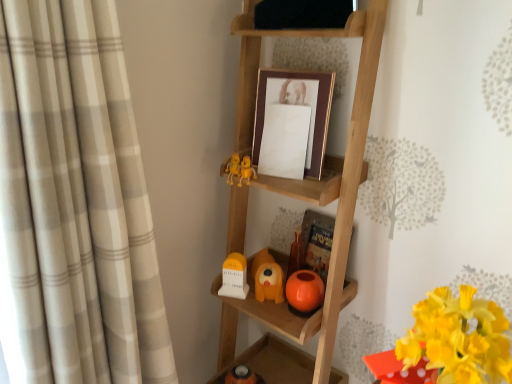
Measure the distance between beige plaid curtain at left and camera.

The depth of beige plaid curtain at left is 21.51 inches.

In order to face black matte shelf at upper center, which is counted as the first shelf, starting from the top, should I rotate leftwards or rightwards?

To face it directly, rotate right by 6.057 degrees.

You are a GUI agent. You are given a task and a screenshot of the screen. Output one action in this format:
    pyautogui.click(x=<x>, y=<y>)
    Task: Click on the white matte clock at lower center, acting as the 2th toy starting from the right
    The image size is (512, 384).
    Given the screenshot: What is the action you would take?
    pyautogui.click(x=234, y=277)

Image resolution: width=512 pixels, height=384 pixels. In order to click on wooden ladder at center, which is the 1th shelf in bottom-to-top order in this screenshot , I will do `click(307, 200)`.

This screenshot has width=512, height=384. What do you see at coordinates (267, 278) in the screenshot?
I see `orange matte dog at center, arranged as the 2th toy when viewed from the left` at bounding box center [267, 278].

In order to face yellow matte flower at lower right, should I rotate leftwards or rightwards?

You should look right and rotate roughly 24.596 degrees.

This screenshot has width=512, height=384. I want to click on beige plaid curtain at left, so tap(75, 203).

From the image's perspective, which object appears higher, white matte clock at lower center, acting as the 2th toy starting from the right, or wooden ladder at center, which is the 1th shelf in bottom-to-top order?

From the image's view, wooden ladder at center, which is the 1th shelf in bottom-to-top order, is above.

Are white matte clock at lower center, acting as the 2th toy starting from the right, and wooden ladder at center, the second shelf viewed from the top, making contact?

No, white matte clock at lower center, acting as the 2th toy starting from the right, is not with wooden ladder at center, the second shelf viewed from the top.

Can we say white matte clock at lower center, which is the first toy in left-to-right order, lies outside wooden ladder at center, the second shelf viewed from the top?

No, white matte clock at lower center, which is the first toy in left-to-right order, is not entirely external to wooden ladder at center, the second shelf viewed from the top.

Is yellow matte flower at lower right positioned beyond the bounds of gold/maroon picture frame at center?

Yes, yellow matte flower at lower right is located beyond the bounds of gold/maroon picture frame at center.

Can you confirm if yellow matte flower at lower right is positioned to the right of gold/maroon picture frame at center?

Yes.

Can you tell me how much yellow matte flower at lower right and gold/maroon picture frame at center differ in facing direction?

The angular difference between yellow matte flower at lower right and gold/maroon picture frame at center is 0.000975 degrees.

Is yellow matte flower at lower right next to gold/maroon picture frame at center and touching it?

yellow matte flower at lower right is not next to gold/maroon picture frame at center, and they're not touching.

Which of these two, gold/maroon picture frame at center or yellow matte flower at lower right, stands taller?

With more height is yellow matte flower at lower right.

Consider the image. From the image's perspective, between gold/maroon picture frame at center and yellow matte flower at lower right, which one is located above?

gold/maroon picture frame at center.

Is gold/maroon picture frame at center not inside yellow matte flower at lower right?

Yes, gold/maroon picture frame at center is outside of yellow matte flower at lower right.

Is gold/maroon picture frame at center facing towards yellow matte flower at lower right?

No, gold/maroon picture frame at center does not turn towards yellow matte flower at lower right.

From the image's perspective, is gold/maroon picture frame at center located above beige plaid curtain at left?

Correct, gold/maroon picture frame at center appears higher than beige plaid curtain at left in the image.

Is gold/maroon picture frame at center wider than beige plaid curtain at left?

In fact, gold/maroon picture frame at center might be narrower than beige plaid curtain at left.

Considering the positions of objects gold/maroon picture frame at center and beige plaid curtain at left in the image provided, who is in front, gold/maroon picture frame at center or beige plaid curtain at left?

beige plaid curtain at left is more forward.

Which is in front, point (270, 75) or point (37, 276)?

Positioned in front is point (37, 276).

From a real-world perspective, is black matte shelf at upper center, the second shelf from the bottom, physically located above or below wooden ladder at center, which is the 1th shelf in bottom-to-top order?

From a real-world perspective, black matte shelf at upper center, the second shelf from the bottom, is physically above wooden ladder at center, which is the 1th shelf in bottom-to-top order.

From the picture: Choose the correct answer: Is black matte shelf at upper center, which is counted as the first shelf, starting from the top, inside wooden ladder at center, which is the 1th shelf in bottom-to-top order, or outside it?

black matte shelf at upper center, which is counted as the first shelf, starting from the top, fits inside wooden ladder at center, which is the 1th shelf in bottom-to-top order.

Does black matte shelf at upper center, the second shelf from the bottom, have a larger size compared to wooden ladder at center, which is the 1th shelf in bottom-to-top order?

Actually, black matte shelf at upper center, the second shelf from the bottom, might be smaller than wooden ladder at center, which is the 1th shelf in bottom-to-top order.

Is black matte shelf at upper center, which is counted as the first shelf, starting from the top, positioned with its back to wooden ladder at center, which is the 1th shelf in bottom-to-top order?

No.

The width and height of the screenshot is (512, 384). In order to click on shelf on the right of the wooden ladder at center, the second shelf viewed from the top in this screenshot , I will do `click(296, 30)`.

Is wooden ladder at center, which is the 1th shelf in bottom-to-top order, beside black matte shelf at upper center, which is counted as the first shelf, starting from the top?

There is a gap between wooden ladder at center, which is the 1th shelf in bottom-to-top order, and black matte shelf at upper center, which is counted as the first shelf, starting from the top.

Who is smaller, wooden ladder at center, which is the 1th shelf in bottom-to-top order, or black matte shelf at upper center, which is counted as the first shelf, starting from the top?

black matte shelf at upper center, which is counted as the first shelf, starting from the top, is smaller.

Is wooden ladder at center, which is the 1th shelf in bottom-to-top order, further to camera compared to black matte shelf at upper center, which is counted as the first shelf, starting from the top?

No, wooden ladder at center, which is the 1th shelf in bottom-to-top order, is closer to the camera.

Is white matte clock at lower center, which is the first toy in left-to-right order, facing away from yellow matte flower at lower right?

No.

Does white matte clock at lower center, acting as the 2th toy starting from the right, have a larger size compared to yellow matte flower at lower right?

No.

Is white matte clock at lower center, acting as the 2th toy starting from the right, to the left of yellow matte flower at lower right from the viewer's perspective?

Correct, you'll find white matte clock at lower center, acting as the 2th toy starting from the right, to the left of yellow matte flower at lower right.

Considering the positions of point (233, 287) and point (472, 354), is point (233, 287) closer or farther from the camera than point (472, 354)?

Point (233, 287) is positioned farther from the camera compared to point (472, 354).

From the image's perspective, which toy is the 2nd one below the wooden ladder at center, the second shelf viewed from the top? Please provide its 2D coordinates.

[(234, 277)]

The image size is (512, 384). What are the coordinates of `picture frame behind the yellow matte flower at lower right` in the screenshot? It's located at (297, 104).

From the image, which object appears to be farther from gold/maroon picture frame at center, beige plaid curtain at left or orange matte dog at center, the first toy when ordered from right to left?

beige plaid curtain at left is positioned further to the anchor gold/maroon picture frame at center.

Looking at the image, which one is located closer to gold/maroon picture frame at center, orange matte dog at center, the first toy when ordered from right to left, or white matte clock at lower center, acting as the 2th toy starting from the right?

orange matte dog at center, the first toy when ordered from right to left, is closer to gold/maroon picture frame at center.

In the scene shown: When comparing their distances from gold/maroon picture frame at center, does beige plaid curtain at left or white matte clock at lower center, acting as the 2th toy starting from the right, seem closer?

Based on the image, white matte clock at lower center, acting as the 2th toy starting from the right, appears to be nearer to gold/maroon picture frame at center.

Consider the image. Estimate the real-world distances between objects in this image. Which object is further from gold/maroon picture frame at center, black matte shelf at upper center, the second shelf from the bottom, or wooden ladder at center, which is the 1th shelf in bottom-to-top order?

Among the two, wooden ladder at center, which is the 1th shelf in bottom-to-top order, is located further to gold/maroon picture frame at center.

Looking at the image, which one is located further to yellow matte flower at lower right, beige plaid curtain at left or gold/maroon picture frame at center?

Among the two, beige plaid curtain at left is located further to yellow matte flower at lower right.

When comparing their distances from white matte clock at lower center, acting as the 2th toy starting from the right, does black matte shelf at upper center, which is counted as the first shelf, starting from the top, or gold/maroon picture frame at center seem closer?

Based on the image, gold/maroon picture frame at center appears to be nearer to white matte clock at lower center, acting as the 2th toy starting from the right.

From the image, which object appears to be farther from beige plaid curtain at left, gold/maroon picture frame at center or yellow matte flower at lower right?

yellow matte flower at lower right.

Which object lies nearer to the anchor point orange matte dog at center, arranged as the 2th toy when viewed from the left, yellow matte flower at lower right or gold/maroon picture frame at center?

gold/maroon picture frame at center is positioned closer to the anchor orange matte dog at center, arranged as the 2th toy when viewed from the left.

Where is `picture frame positioned between wooden ladder at center, the second shelf viewed from the top, and orange matte dog at center, the first toy when ordered from right to left, from near to far`? Image resolution: width=512 pixels, height=384 pixels. picture frame positioned between wooden ladder at center, the second shelf viewed from the top, and orange matte dog at center, the first toy when ordered from right to left, from near to far is located at coordinates (297, 104).

Locate an element on the screen. The width and height of the screenshot is (512, 384). curtain between black matte shelf at upper center, which is counted as the first shelf, starting from the top, and wooden ladder at center, the second shelf viewed from the top, vertically is located at coordinates (75, 203).

The width and height of the screenshot is (512, 384). What are the coordinates of `picture frame between black matte shelf at upper center, which is counted as the first shelf, starting from the top, and white matte clock at lower center, which is the first toy in left-to-right order, in the vertical direction` in the screenshot? It's located at (297, 104).

This screenshot has width=512, height=384. In order to click on curtain that lies between black matte shelf at upper center, which is counted as the first shelf, starting from the top, and orange matte dog at center, arranged as the 2th toy when viewed from the left, from top to bottom in this screenshot , I will do `click(75, 203)`.